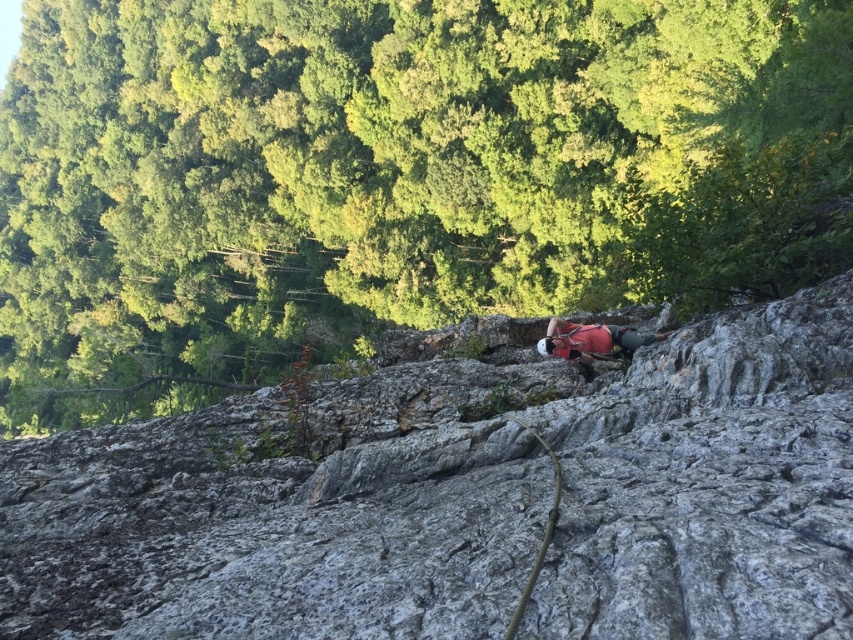
Question: Is gray rough rock at center closer to the viewer compared to matte red shirt at center?

Choices:
 (A) no
 (B) yes

Answer: (B)

Question: Which point is closer to the camera?

Choices:
 (A) (61, 412)
 (B) (548, 512)

Answer: (B)

Question: Observing the image, what is the correct spatial positioning of gray rough rock at center in reference to matte red shirt at center?

Choices:
 (A) left
 (B) right

Answer: (A)

Question: Which point appears farthest from the camera in this image?

Choices:
 (A) (640, 339)
 (B) (461, 442)

Answer: (A)

Question: Is gray rough rock at center to the right of green rubber rope at center from the viewer's perspective?

Choices:
 (A) no
 (B) yes

Answer: (A)

Question: Among these objects, which one is nearest to the camera?

Choices:
 (A) green leafy tree at upper center
 (B) gray rough rock at center

Answer: (B)